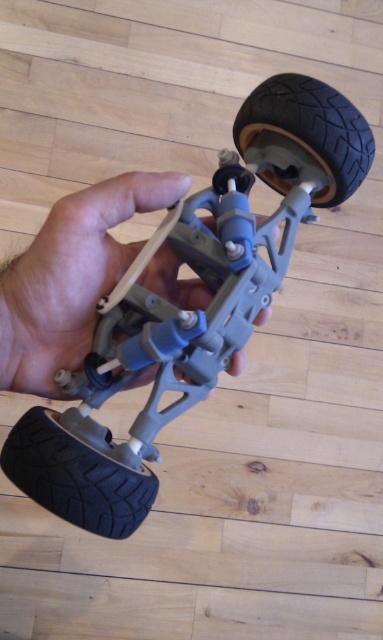
You are a toy designer examining the model of the vehicle suspension system. You need to determine if the gray matte plastic hand at center can reach the black rubber tire at upper right. Based on their sizes, can the hand at center grasp the tire at upper right?

The gray matte plastic hand at center is much taller than the black rubber tire at upper right. Since the hand is significantly larger, it can easily grasp the tire at upper right.

You are a robotic arm trying to pick up the model suspension system. There are two points marked in the image. The first point is at coordinate point (60, 282) and the second point is at coordinate point (266, 80). Which point should you move towards first to approach the suspension system from the front?

Point (60, 282) is in front of point (266, 80), so you should move towards point (60, 282) first to approach the suspension system from the front.

You are a toy designer examining a model of a toy car. You notice a specific point marked at coordinates (x=191, y=310). Based on the model, where is this point located?

The point at (x=191, y=310) is on the matte gray plastic toy car at center.